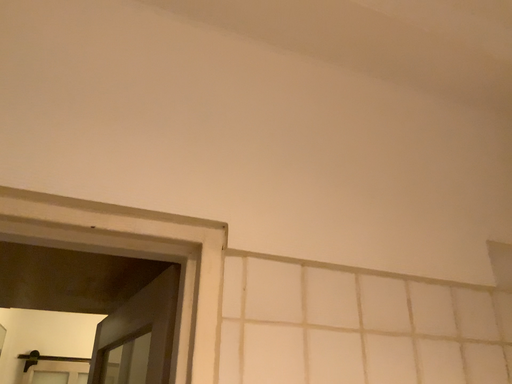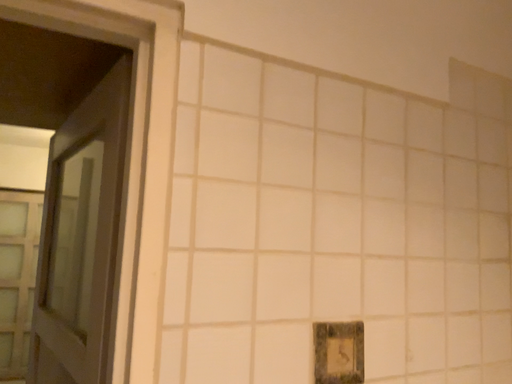
Question: How did the camera likely rotate when shooting the video?

Choices:
 (A) rotated upward
 (B) rotated downward

Answer: (B)